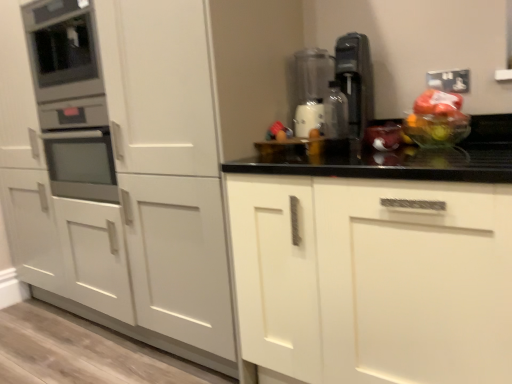
Question: From the image's perspective, would you say white matte cabinet at center, arranged as the 1th cabinetry when viewed from the left, is shown under transparent plastic blender at center, the 1th appliance positioned from the right?

Choices:
 (A) yes
 (B) no

Answer: (A)

Question: Is white matte cabinet at center, positioned as the second cabinetry in right-to-left order, outside transparent plastic blender at center, the 1th appliance positioned from the right?

Choices:
 (A) yes
 (B) no

Answer: (A)

Question: Does white matte cabinet at center, positioned as the second cabinetry in right-to-left order, appear on the right side of transparent plastic blender at center, which is the 2th appliance from left to right?

Choices:
 (A) no
 (B) yes

Answer: (A)

Question: Is white matte cabinet at center, arranged as the 1th cabinetry when viewed from the left, thinner than transparent plastic blender at center, which is the 2th appliance from left to right?

Choices:
 (A) no
 (B) yes

Answer: (A)

Question: Can you confirm if white matte cabinet at center, positioned as the second cabinetry in right-to-left order, is positioned to the left of transparent plastic blender at center, which is the 2th appliance from left to right?

Choices:
 (A) no
 (B) yes

Answer: (B)

Question: From a real-world perspective, is white matte cabinet at center, positioned as the second cabinetry in right-to-left order, located higher than transparent plastic blender at center, the 1th appliance positioned from the right?

Choices:
 (A) no
 (B) yes

Answer: (A)

Question: Considering the relative sizes of satin silver coffee machine at upper right and white matte cabinet at center, which appears as the second cabinetry when viewed from the left, in the image provided, is satin silver coffee machine at upper right bigger than white matte cabinet at center, which appears as the second cabinetry when viewed from the left,?

Choices:
 (A) no
 (B) yes

Answer: (A)

Question: Is satin silver coffee machine at upper right placed right next to white matte cabinet at center, the first cabinetry viewed from the right?

Choices:
 (A) yes
 (B) no

Answer: (B)

Question: Is satin silver coffee machine at upper right facing towards white matte cabinet at center, which appears as the second cabinetry when viewed from the left?

Choices:
 (A) yes
 (B) no

Answer: (B)

Question: Can you confirm if satin silver coffee machine at upper right is shorter than white matte cabinet at center, which appears as the second cabinetry when viewed from the left?

Choices:
 (A) yes
 (B) no

Answer: (A)

Question: Does satin silver coffee machine at upper right come behind white matte cabinet at center, the first cabinetry viewed from the right?

Choices:
 (A) yes
 (B) no

Answer: (A)

Question: From a real-world perspective, is satin silver coffee machine at upper right located higher than white matte cabinet at center, the first cabinetry viewed from the right?

Choices:
 (A) no
 (B) yes

Answer: (B)

Question: Is translucent plastic bag at center turned away from metallic oven at left, placed as the second appliance when sorted from right to left?

Choices:
 (A) no
 (B) yes

Answer: (A)